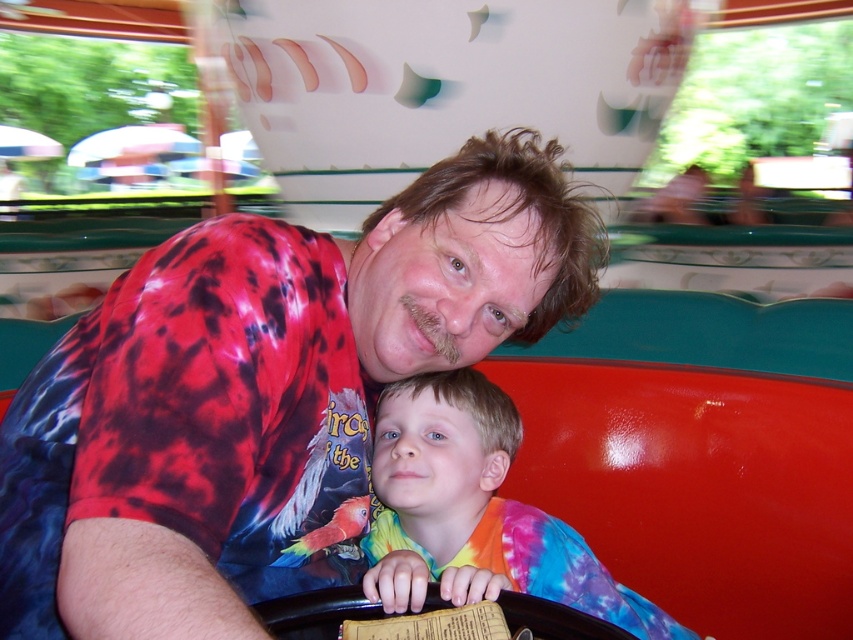
Which of these two, tie-dye shirt at center or tie-dye fabric at center, stands taller?

tie-dye shirt at center

This screenshot has width=853, height=640. What do you see at coordinates (273, 376) in the screenshot?
I see `tie-dye shirt at center` at bounding box center [273, 376].

Locate an element on the screen. The height and width of the screenshot is (640, 853). tie-dye shirt at center is located at coordinates (273, 376).